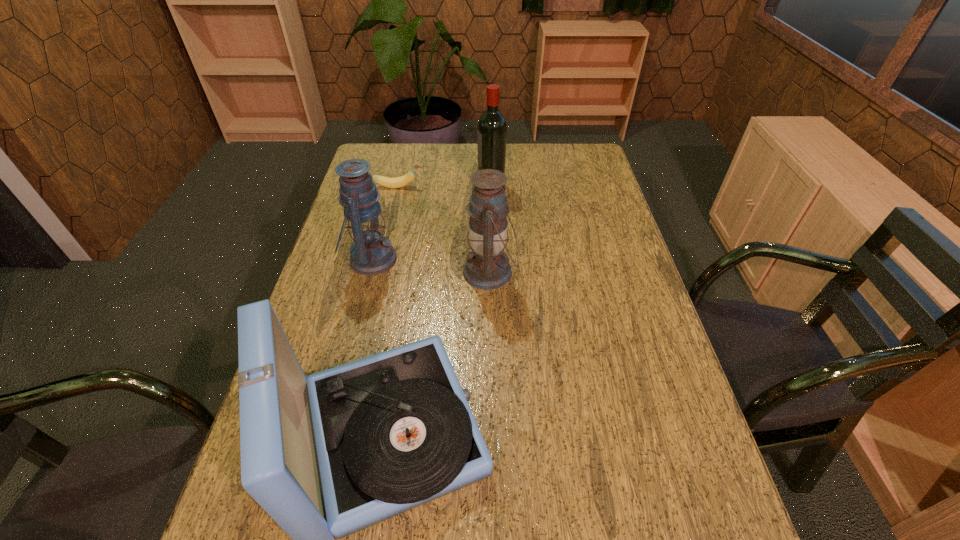
Locate an element on the screen. This screenshot has height=540, width=960. free location that satisfies the following two spatial constraints: 1. on the front-facing side of the lantern; 2. on the back side of the oil lamp is located at coordinates (368, 272).

I want to click on free spot that satisfies the following two spatial constraints: 1. on the front-facing side of the lantern; 2. on the back side of the oil lamp, so click(368, 272).